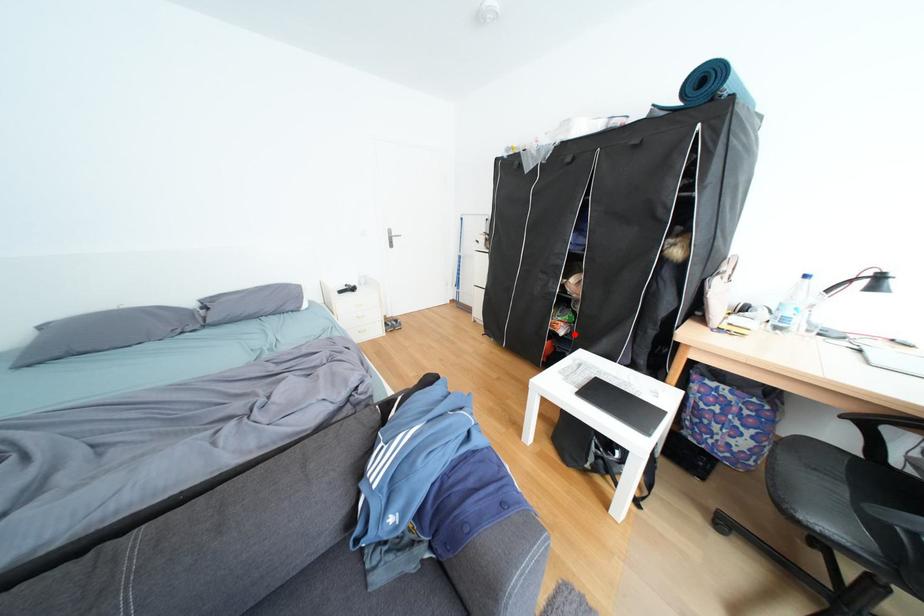
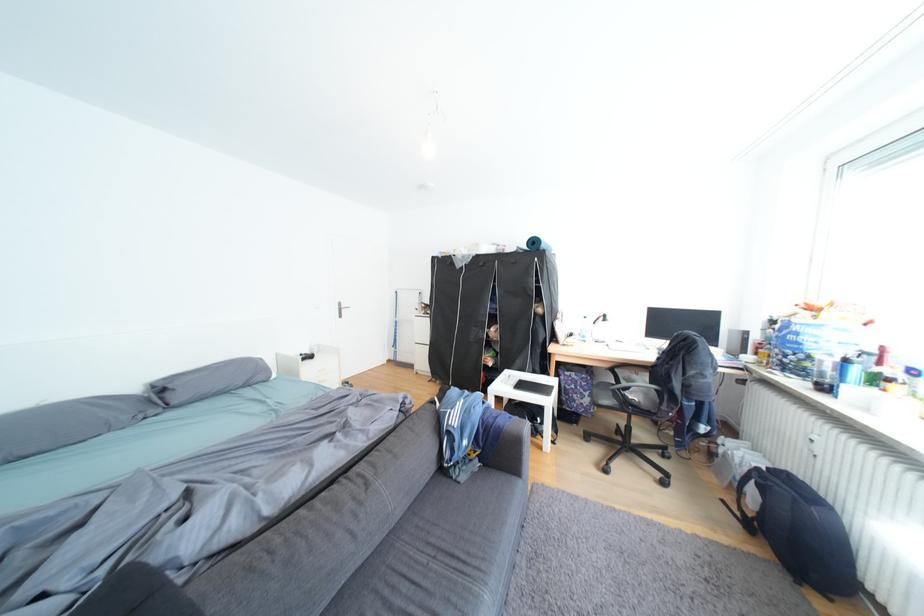
Find the pixel in the second image that matches the highlighted location in the first image.

(504, 365)